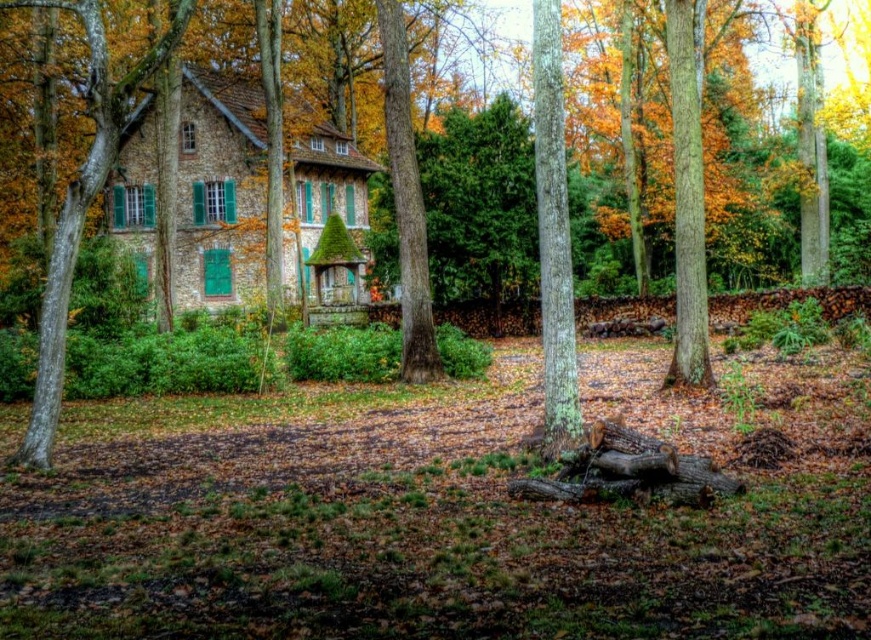
Based on the scene description, what does the point at coordinate (x=82, y=205) represent?

The point at coordinate (x=82, y=205) represents a smooth bark tree at the left.

You are an architect designing a new garden and want to place a small wooden bench between the smooth bark tree at left and the green rough bark tree at center. Which tree should the bench be closer to if you want it to be near the larger tree?

The smooth bark tree at left is bigger than the green rough bark tree at center, so the bench should be placed closer to the smooth bark tree at left to be near the larger tree.

You are standing at the center of the image and want to walk towards the point marked as point (687, 193). Which direction should you go?

The point (687, 193) corresponds to the smooth brown tree trunk at right, so you should walk towards the right side of the image to reach it.